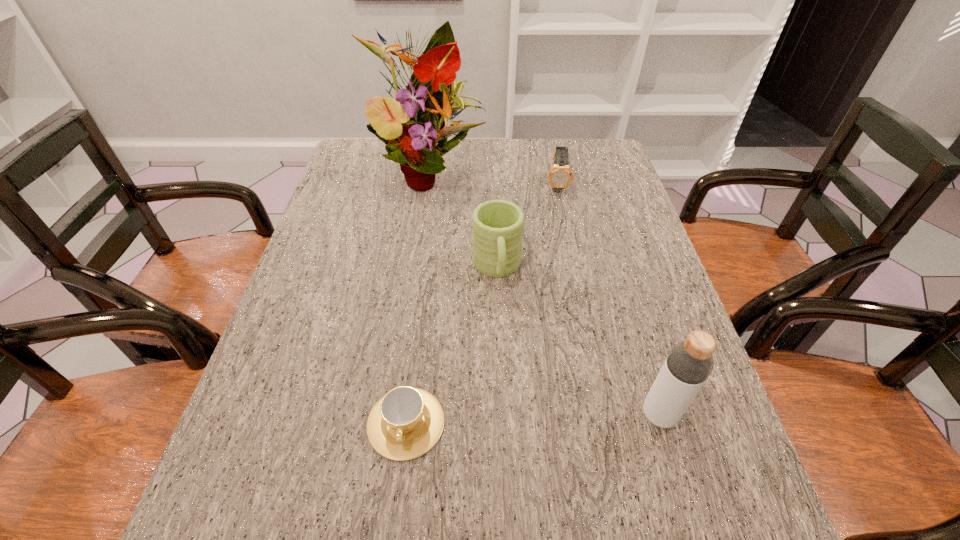
Locate an element on the screen. This screenshot has width=960, height=540. cup is located at coordinates (407, 422).

Where is `the rightmost object`? the rightmost object is located at coordinates (689, 363).

At what (x,y) coordinates should I click in order to perform the action: click on the second tallest object. Please return your answer as a coordinate pair (x, y). Image resolution: width=960 pixels, height=540 pixels. Looking at the image, I should click on (689, 363).

You are a GUI agent. You are given a task and a screenshot of the screen. Output one action in this format:
    pyautogui.click(x=<x>, y=<y>)
    Task: Click on the watch
    This screenshot has width=960, height=540.
    Given the screenshot: What is the action you would take?
    pyautogui.click(x=560, y=176)

Identify the location of the second shortest object. (560, 176).

Locate an element on the screen. mug is located at coordinates (498, 225).

Find the location of a particular element. the third farthest object is located at coordinates (498, 225).

The image size is (960, 540). I want to click on bouquet, so click(420, 116).

Locate an element on the screen. This screenshot has width=960, height=540. free space located 0.260m on the back of the rightmost object is located at coordinates (624, 299).

Identify the location of free location located on the face of the second object from right to left. (561, 238).